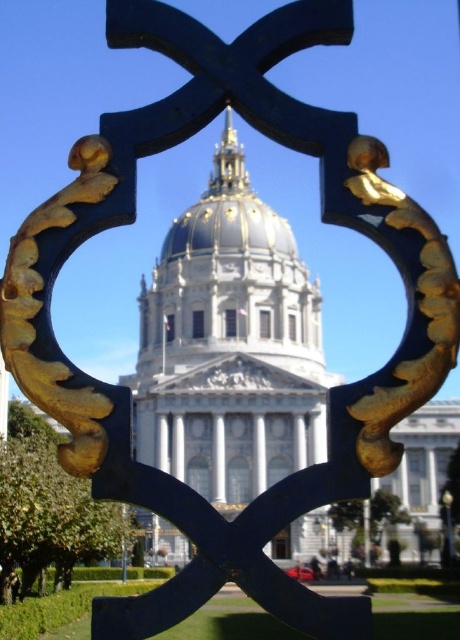
Does point (201, 218) lie in front of point (212, 248)?

No, it is behind (212, 248).

Consider the image. Between white marble cathedral at center and gold/gilded dome at center, which one is positioned higher?

gold/gilded dome at center is above.

This screenshot has width=460, height=640. Describe the element at coordinates (230, 346) in the screenshot. I see `white marble cathedral at center` at that location.

Where is `white marble cathedral at center`? white marble cathedral at center is located at coordinates (230, 346).